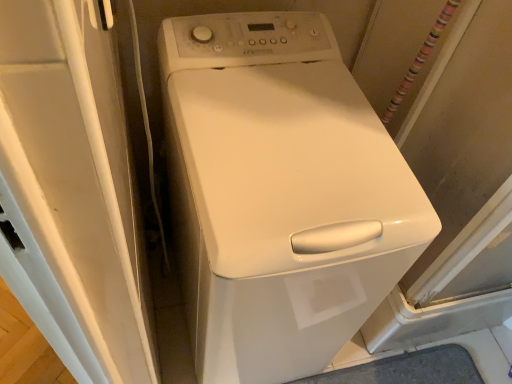
What do you see at coordinates (280, 194) in the screenshot? I see `white glossy washing machine at center` at bounding box center [280, 194].

This screenshot has width=512, height=384. In order to click on white glossy washing machine at center in this screenshot , I will do `click(280, 194)`.

The image size is (512, 384). Identify the location of white glossy washing machine at center. (280, 194).